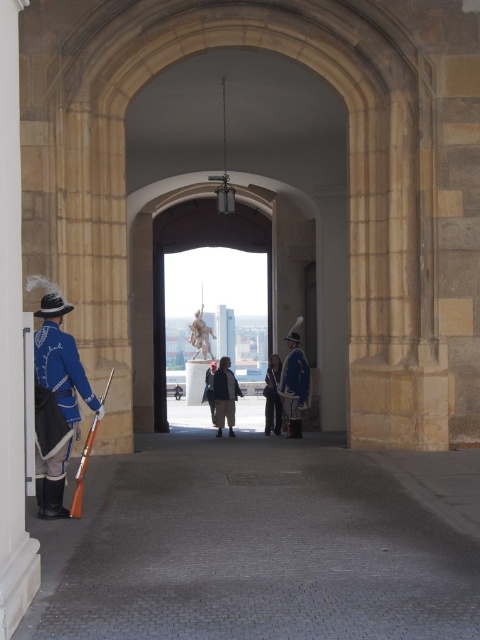
You are a visitor standing at the entrance of the archway and notice two blue fabric items in the center. If you want to touch both the blue fabric uniform at center and the blue fabric coat at center, which one requires you to walk a shorter distance?

The blue fabric uniform at center is 10.50 feet away from the blue fabric coat at center, so you need to know their individual distances from your current position. However, since both are at the center, it is likely they are near each other. Without exact individual distances, it is impossible to determine which requires a shorter walk.

You are a visitor observing two guards in the archway. You see a blue fabric uniform at center and a blue fabric coat at center. Which one is located to the right?

The blue fabric uniform at center is positioned on the right side of the blue fabric coat at center.